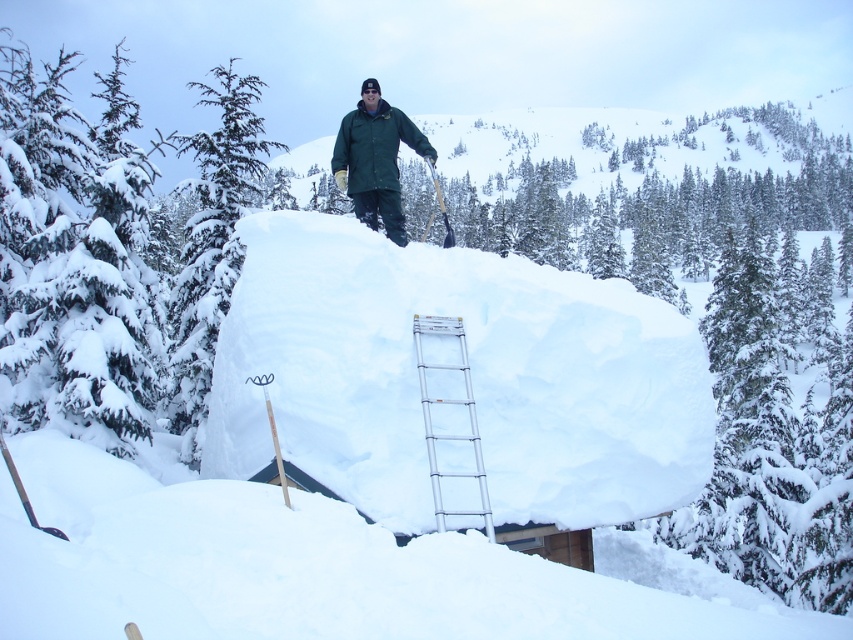
Is snowy evergreen tree at left to the right of green matte jacket at upper center from the viewer's perspective?

No, snowy evergreen tree at left is not to the right of green matte jacket at upper center.

Is snowy evergreen tree at left thinner than green matte jacket at upper center?

In fact, snowy evergreen tree at left might be wider than green matte jacket at upper center.

Locate an element on the screen. This screenshot has height=640, width=853. snowy evergreen tree at left is located at coordinates (212, 244).

Does green matte jacket at upper center come in front of silver metallic ladder at center?

No, green matte jacket at upper center is further to the viewer.

Can you confirm if green matte jacket at upper center is positioned above silver metallic ladder at center?

Yes.

Between point (421, 150) and point (454, 324), which one is positioned behind?

The point (421, 150) is more distant.

At what (x,y) coordinates should I click in order to perform the action: click on green matte jacket at upper center. Please return your answer as a coordinate pair (x, y). The height and width of the screenshot is (640, 853). Looking at the image, I should click on (375, 160).

Who is positioned more to the right, white fluffy snow at center or green matte jacket at upper center?

white fluffy snow at center

Between white fluffy snow at center and green matte jacket at upper center, which one is positioned lower?

white fluffy snow at center is lower down.

You are a GUI agent. You are given a task and a screenshot of the screen. Output one action in this format:
    pyautogui.click(x=<x>, y=<y>)
    Task: Click on the white fluffy snow at center
    This screenshot has width=853, height=640.
    Given the screenshot: What is the action you would take?
    pyautogui.click(x=469, y=376)